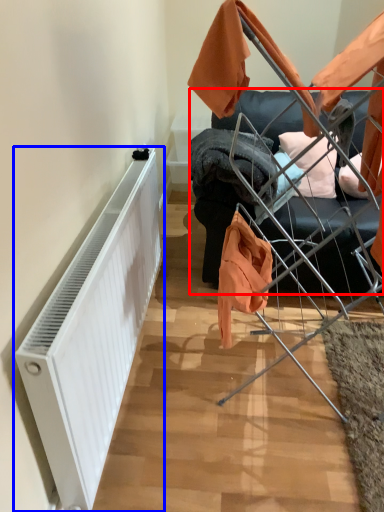
Question: Which point is closer to the camera, furniture (highlighted by a red box) or radiator (highlighted by a blue box)?

Choices:
 (A) furniture
 (B) radiator

Answer: (B)